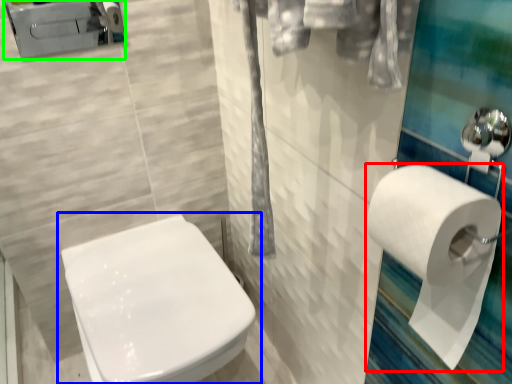
Question: Based on their relative distances, which object is farther from toilet paper (highlighted by a red box)? Choose from toilet (highlighted by a blue box) and porcelain (highlighted by a green box).

Choices:
 (A) toilet
 (B) porcelain

Answer: (B)